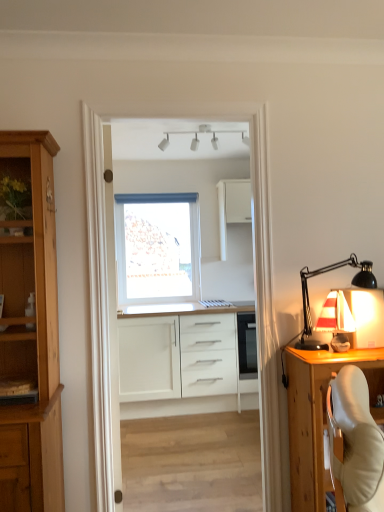
This screenshot has height=512, width=384. What do you see at coordinates (113, 343) in the screenshot?
I see `white glossy door at center` at bounding box center [113, 343].

The image size is (384, 512). I want to click on white matte cabinet at upper center, acting as the first cabinetry starting from the top, so click(x=232, y=207).

The width and height of the screenshot is (384, 512). Find the location of `white matte cabinet at center, which is the 1th cabinetry from bottom to top`. white matte cabinet at center, which is the 1th cabinetry from bottom to top is located at coordinates (180, 362).

In order to face white matte window at center, should I rotate leftwards or rightwards?

To align with it, rotate left about 3.655°.

Measure the distance between point (144, 244) and camera.

Point (144, 244) is 17.85 feet away from camera.

Describe the element at coordinates (326, 272) in the screenshot. The width and height of the screenshot is (384, 512). I see `white fabric lampshade at right, the 1th lamp from the front` at that location.

The height and width of the screenshot is (512, 384). I want to click on white glossy door at center, so click(113, 343).

Is white matte window at center not close to white fabric lampshade at right, arranged as the 2th lamp when viewed from the back?

Yes, white matte window at center is far from white fabric lampshade at right, arranged as the 2th lamp when viewed from the back.

Can you confirm if white matte window at center is positioned to the left of white fabric lampshade at right, positioned as the first lamp in bottom-to-top order?

A: Yes, white matte window at center is to the left of white fabric lampshade at right, positioned as the first lamp in bottom-to-top order.

Looking at this image, can you confirm if white matte window at center is bigger than white fabric lampshade at right, positioned as the first lamp in bottom-to-top order?

Indeed, white matte window at center has a larger size compared to white fabric lampshade at right, positioned as the first lamp in bottom-to-top order.

Considering the relative sizes of white glossy cabinet at center and matte white sailboat at right in the image provided, is white glossy cabinet at center smaller than matte white sailboat at right?

No, white glossy cabinet at center is not smaller than matte white sailboat at right.

From a real-world perspective, which object stands above the other?

From a 3D spatial view, white glossy cabinet at center is above.

Is white glossy cabinet at center next to matte white sailboat at right and touching it?

No, white glossy cabinet at center is not next to matte white sailboat at right.

Considering the sizes of white matte cabinet at center, which is the 2th cabinetry from back to front, and wooden cabinet at right, acting as the second cabinetry starting from the top, in the image, is white matte cabinet at center, which is the 2th cabinetry from back to front, taller or shorter than wooden cabinet at right, acting as the second cabinetry starting from the top,?

In the image, white matte cabinet at center, which is the 2th cabinetry from back to front, appears to be taller than wooden cabinet at right, acting as the second cabinetry starting from the top.

Can wooden cabinet at right, acting as the 2th cabinetry starting from the bottom, be found inside white matte cabinet at center, which is the 1th cabinetry from bottom to top?

No, wooden cabinet at right, acting as the 2th cabinetry starting from the bottom, is not surrounded by white matte cabinet at center, which is the 1th cabinetry from bottom to top.

Does point (187, 373) lie behind point (303, 503)?

Yes.

Is white matte cabinet at center, which is the 1th cabinetry from bottom to top, in front of or behind wooden cabinet at right, arranged as the 1th cabinetry when viewed from the front, in the image?

Visually, white matte cabinet at center, which is the 1th cabinetry from bottom to top, is located behind wooden cabinet at right, arranged as the 1th cabinetry when viewed from the front.

Can you tell me how much white glossy door at center and matte white sailboat at right differ in facing direction?

91.7 degrees separate the facing orientations of white glossy door at center and matte white sailboat at right.

Locate an element on the screen. The height and width of the screenshot is (512, 384). door below the matte white sailboat at right (from a real-world perspective) is located at coordinates (113, 343).

Based on their sizes in the image, would you say white glossy door at center is bigger or smaller than matte white sailboat at right?

In the image, white glossy door at center appears to be larger than matte white sailboat at right.

Does point (113, 445) lie in front of point (337, 345)?

No, (113, 445) is further to viewer.

Who is taller, white matte cabinet at upper center, which is the first cabinetry from back to front, or white fabric lampshade at right, arranged as the 2th lamp when viewed from the top?

Standing taller between the two is white matte cabinet at upper center, which is the first cabinetry from back to front.

In terms of width, does white matte cabinet at upper center, positioned as the third cabinetry in bottom-to-top order, look wider or thinner when compared to white fabric lampshade at right, the 1th lamp from the right?

Considering their sizes, white matte cabinet at upper center, positioned as the third cabinetry in bottom-to-top order, looks slimmer than white fabric lampshade at right, the 1th lamp from the right.

Does point (231, 195) lie in front of point (367, 281)?

No, it is behind (367, 281).

From a real-world perspective, which object stands above the other?

white matte track lights at upper center, the second lamp when ordered from bottom to top, from a real-world perspective.

Is white matte track lights at upper center, which is the second lamp in front-to-back order, shorter than white matte window at center?

Indeed, white matte track lights at upper center, which is the second lamp in front-to-back order, has a lesser height compared to white matte window at center.

Considering the relative positions of white matte track lights at upper center, the first lamp in the left-to-right sequence, and white matte window at center in the image provided, is white matte track lights at upper center, the first lamp in the left-to-right sequence, to the left of white matte window at center from the viewer's perspective?

Incorrect, white matte track lights at upper center, the first lamp in the left-to-right sequence, is not on the left side of white matte window at center.

From the image's perspective, is white matte track lights at upper center, the first lamp in the left-to-right sequence, under white matte window at center?

No.

Consider the image. Is wooden cabinet at right, acting as the second cabinetry starting from the top, next to white matte cabinet at upper center, which is the first cabinetry from back to front, and touching it?

No, wooden cabinet at right, acting as the second cabinetry starting from the top, is not touching white matte cabinet at upper center, which is the first cabinetry from back to front.

Considering the relative sizes of wooden cabinet at right, arranged as the 1th cabinetry when viewed from the front, and white matte cabinet at upper center, acting as the first cabinetry starting from the top, in the image provided, is wooden cabinet at right, arranged as the 1th cabinetry when viewed from the front, wider than white matte cabinet at upper center, acting as the first cabinetry starting from the top,?

Yes.

From the image's perspective, between wooden cabinet at right, acting as the 3th cabinetry starting from the back, and white matte cabinet at upper center, positioned as the third cabinetry in bottom-to-top order, which one is located above?

white matte cabinet at upper center, positioned as the third cabinetry in bottom-to-top order, is shown above in the image.

Is white matte cabinet at upper center, positioned as the third cabinetry in bottom-to-top order, a part of wooden cabinet at right, acting as the 3th cabinetry starting from the back?

Actually, white matte cabinet at upper center, positioned as the third cabinetry in bottom-to-top order, is outside wooden cabinet at right, acting as the 3th cabinetry starting from the back.

Starting from the white matte window at center, which lamp is the 2nd one in front? Please provide its 2D coordinates.

[(326, 272)]

Identify the location of screen door behind the matte white sailboat at right. (260, 217).

When comparing their distances from white fabric lampshade at right, the 1th lamp from the right, does white matte window at center or white matte cabinet at center, the 3th cabinetry in the top-to-bottom sequence, seem further?

white matte window at center lies further to white fabric lampshade at right, the 1th lamp from the right, than the other object.

Considering their positions, is white matte track lights at upper center, the first lamp in the left-to-right sequence, positioned closer to white matte cabinet at upper center, acting as the 3th cabinetry starting from the front, than white matte cabinet at center, which is the 1th cabinetry from bottom to top?

white matte track lights at upper center, the first lamp in the left-to-right sequence, lies closer to white matte cabinet at upper center, acting as the 3th cabinetry starting from the front, than the other object.

Which object lies further to the anchor point wooden cabinet at right, acting as the second cabinetry starting from the top, white glossy door at center or white matte track lights at upper center, which is the second lamp in front-to-back order?

white matte track lights at upper center, which is the second lamp in front-to-back order.

When comparing their distances from white matte window at center, does matte white sailboat at right or white glossy door at center seem further?

matte white sailboat at right is positioned further to the anchor white matte window at center.

When comparing their distances from white matte cabinet at upper center, which is the first cabinetry from back to front, does white fabric lampshade at right, arranged as the 2th lamp when viewed from the back, or wooden cabinet at right, arranged as the 1th cabinetry when viewed from the front, seem further?

wooden cabinet at right, arranged as the 1th cabinetry when viewed from the front, is positioned further to the anchor white matte cabinet at upper center, which is the first cabinetry from back to front.

When comparing their distances from white glossy cabinet at center, does white matte cabinet at center, the second cabinetry when ordered from front to back, or wooden cabinet at right, acting as the 3th cabinetry starting from the back, seem closer?

wooden cabinet at right, acting as the 3th cabinetry starting from the back, is positioned closer to the anchor white glossy cabinet at center.

Based on their spatial positions, is white glossy door at center or matte white sailboat at right further from wooden cabinet at right, acting as the second cabinetry starting from the top?

Among the two, white glossy door at center is located further to wooden cabinet at right, acting as the second cabinetry starting from the top.

When comparing their distances from white matte track lights at upper center, the first lamp in the left-to-right sequence, does white matte window at center or matte white sailboat at right seem further?

matte white sailboat at right is further to white matte track lights at upper center, the first lamp in the left-to-right sequence.

At what (x,y) coordinates should I click in order to perform the action: click on door between wooden cabinet at right, arranged as the 1th cabinetry when viewed from the front, and white matte cabinet at center, which is the 2th cabinetry from back to front, along the z-axis. Please return your answer as a coordinate pair (x, y). This screenshot has height=512, width=384. Looking at the image, I should click on (113, 343).

This screenshot has height=512, width=384. Identify the location of lamp located between white glossy door at center and white matte window at center in the depth direction. (229, 132).

You are a GUI agent. You are given a task and a screenshot of the screen. Output one action in this format:
    pyautogui.click(x=<x>, y=<y>)
    Task: Click on the table lamp between white fabric lampshade at right, which appears as the second lamp when viewed from the left, and white matte window at center, along the z-axis
    The height and width of the screenshot is (512, 384).
    Given the screenshot: What is the action you would take?
    pyautogui.click(x=336, y=320)

Where is `door between white glossy cabinet at center and white matte cabinet at upper center, positioned as the third cabinetry in bottom-to-top order, from front to back`? door between white glossy cabinet at center and white matte cabinet at upper center, positioned as the third cabinetry in bottom-to-top order, from front to back is located at coordinates (113, 343).